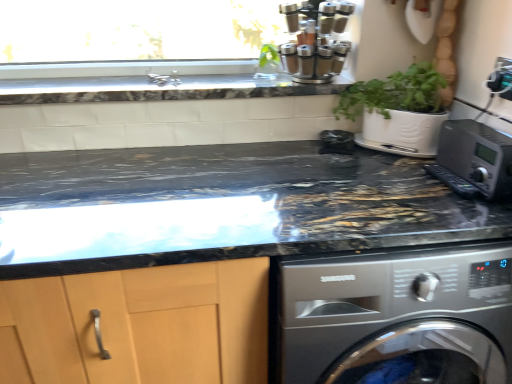
Question: Does black marble countertop at upper center, which is the first countertop from top to bottom, appear on the right side of satin silver spice rack at upper center?

Choices:
 (A) no
 (B) yes

Answer: (A)

Question: Does black marble countertop at upper center, which is the first countertop from top to bottom, have a greater height compared to satin silver spice rack at upper center?

Choices:
 (A) no
 (B) yes

Answer: (A)

Question: Can you see black marble countertop at upper center, which is the first countertop from top to bottom, touching satin silver spice rack at upper center?

Choices:
 (A) no
 (B) yes

Answer: (A)

Question: Does black marble countertop at upper center, marked as the 2th countertop in a bottom-to-top arrangement, have a lesser width compared to satin silver spice rack at upper center?

Choices:
 (A) no
 (B) yes

Answer: (A)

Question: Is black marble countertop at upper center, marked as the 2th countertop in a bottom-to-top arrangement, further to camera compared to satin silver spice rack at upper center?

Choices:
 (A) yes
 (B) no

Answer: (A)

Question: Is black marble countertop at upper center, which is the first countertop from top to bottom, not within satin silver spice rack at upper center?

Choices:
 (A) yes
 (B) no

Answer: (A)

Question: Is marble at center, positioned as the first countertop in bottom-to-top order, at the left side of satin silver spice rack at upper center?

Choices:
 (A) no
 (B) yes

Answer: (B)

Question: Is marble at center, positioned as the first countertop in bottom-to-top order, aimed at satin silver spice rack at upper center?

Choices:
 (A) no
 (B) yes

Answer: (A)

Question: Can you confirm if marble at center, which is the 2th countertop in top-to-bottom order, is taller than satin silver spice rack at upper center?

Choices:
 (A) yes
 (B) no

Answer: (A)

Question: From a real-world perspective, is marble at center, positioned as the first countertop in bottom-to-top order, on satin silver spice rack at upper center?

Choices:
 (A) no
 (B) yes

Answer: (A)

Question: Is marble at center, which is the 2th countertop in top-to-bottom order, outside satin silver spice rack at upper center?

Choices:
 (A) yes
 (B) no

Answer: (A)

Question: Are marble at center, which is the 2th countertop in top-to-bottom order, and satin silver spice rack at upper center beside each other?

Choices:
 (A) no
 (B) yes

Answer: (A)

Question: From the image's perspective, is black marble countertop at upper center, marked as the 2th countertop in a bottom-to-top arrangement, above green leafy plant at upper center?

Choices:
 (A) yes
 (B) no

Answer: (B)